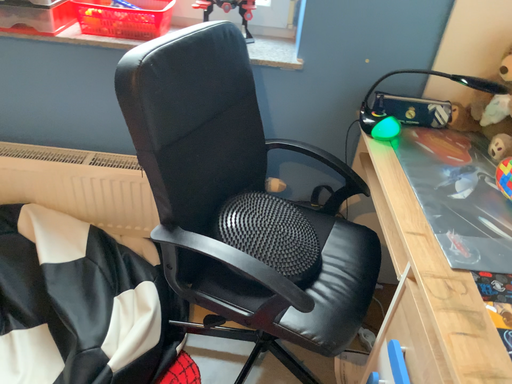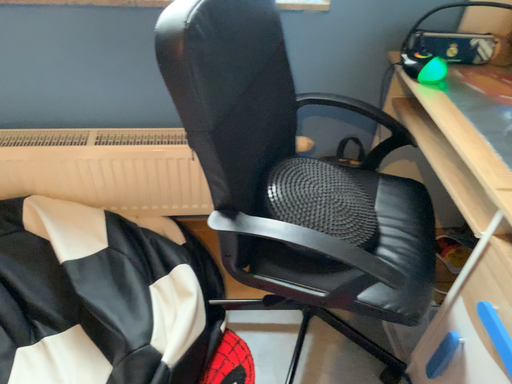
Question: Which way did the camera rotate in the video?

Choices:
 (A) rotated upward
 (B) rotated downward

Answer: (B)